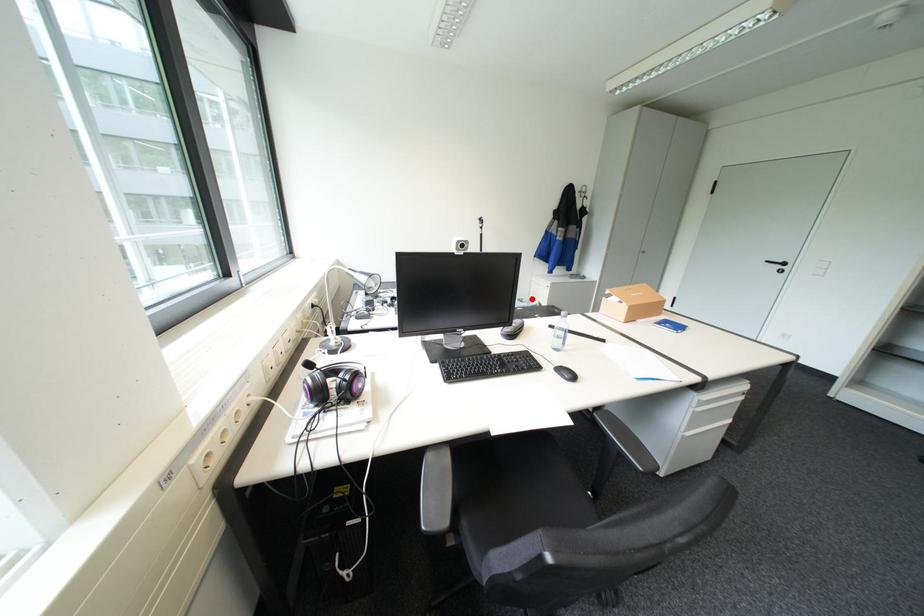
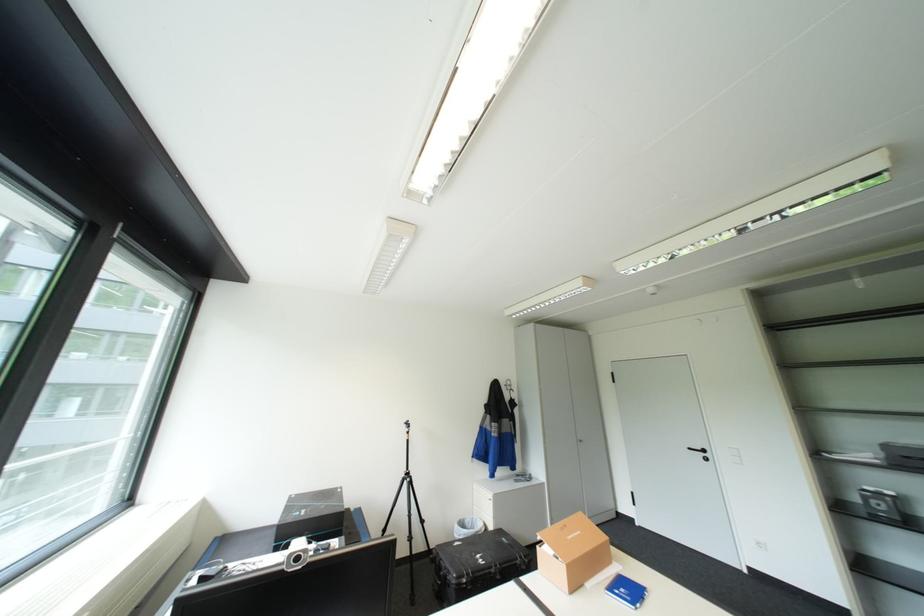
Question: I am providing you with two images of the same scene from different viewpoints. Image1 has a red point marked. In image2, the corresponding 3D location appears at what relative position? Reply with the corresponding letter.

Choices:
 (A) Closer
 (B) Farther

Answer: (B)